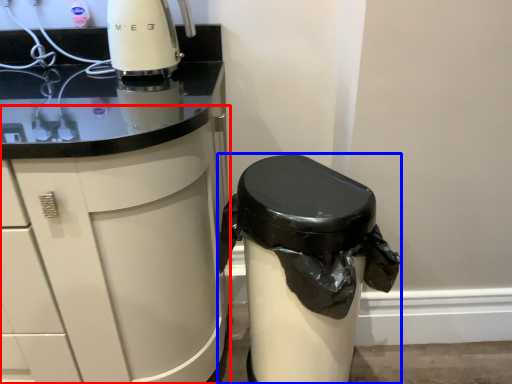
Question: Which object appears farthest to the camera in this image, cabinetry (highlighted by a red box) or waste container (highlighted by a blue box)?

Choices:
 (A) cabinetry
 (B) waste container

Answer: (B)